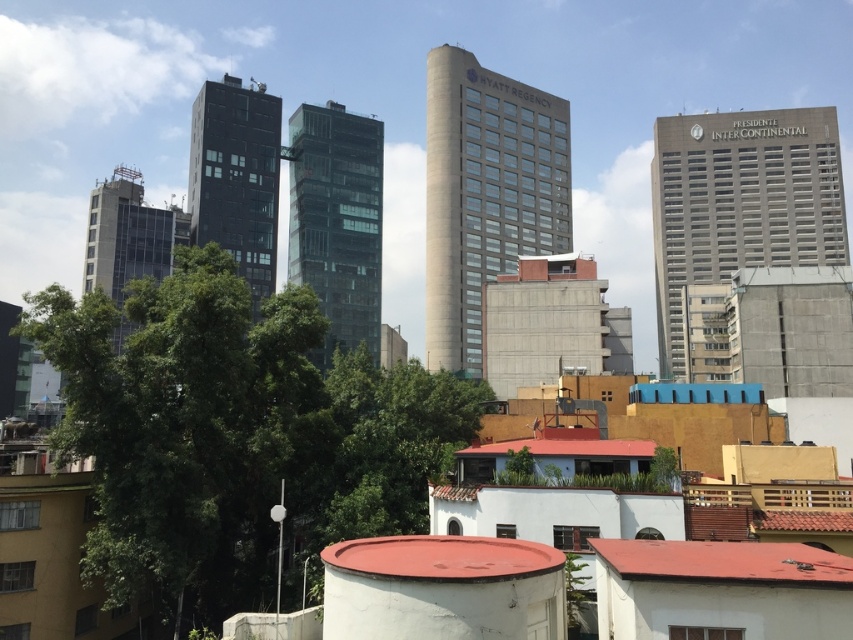
Question: Which is farther from the gray concrete building at left?

Choices:
 (A) black glass building at center
 (B) green leafy tree at center
 (C) glassy black building at center
 (D) beige concrete tower at center

Answer: (D)

Question: Is green leafy tree at center above beige concrete tower at center?

Choices:
 (A) no
 (B) yes

Answer: (A)

Question: Which point is closer to the camera?

Choices:
 (A) green leafy tree at center
 (B) gray concrete building at upper right

Answer: (A)

Question: Can you confirm if green leafy tree at center is thinner than beige concrete tower at center?

Choices:
 (A) yes
 (B) no

Answer: (A)

Question: Does beige concrete tower at center come in front of black glass building at center?

Choices:
 (A) no
 (B) yes

Answer: (A)

Question: Among these objects, which one is nearest to the camera?

Choices:
 (A) green leafy tree at center
 (B) black glass building at center
 (C) gray concrete building at upper right
 (D) beige concrete tower at center

Answer: (A)